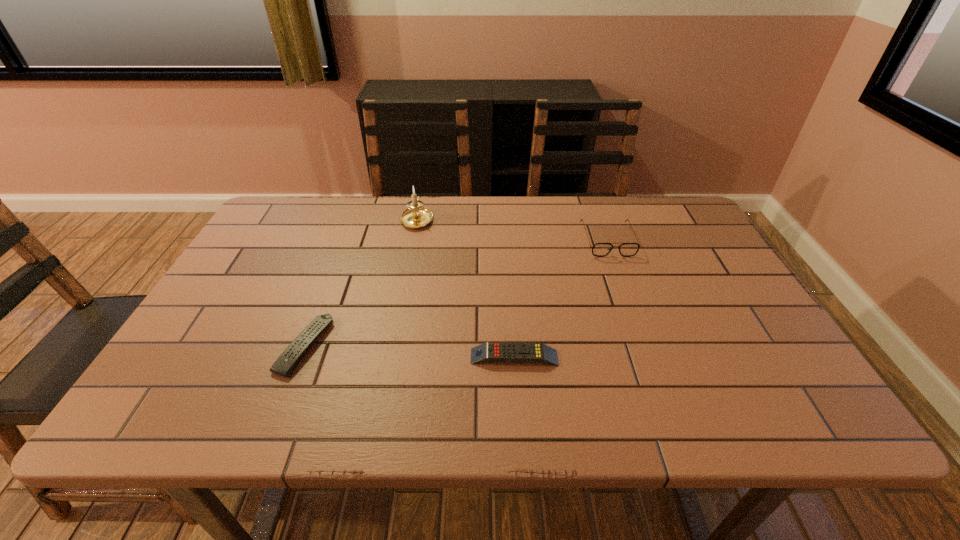
Locate an element on the screen. The width and height of the screenshot is (960, 540). free space between the tallest object and the right remote control is located at coordinates (466, 288).

I want to click on vacant area that lies between the leftmost object and the second object from left to right, so click(x=361, y=282).

What are the coordinates of `free spot between the right remote control and the left remote control` in the screenshot? It's located at (410, 352).

Find the location of a particular element. free space that is in between the right remote control and the left remote control is located at coordinates (410, 352).

I want to click on vacant region between the sunglasses and the tallest object, so point(513,230).

The image size is (960, 540). What are the coordinates of `unoccupied area between the rightmost object and the right remote control` in the screenshot? It's located at (561, 299).

Locate an element on the screen. This screenshot has width=960, height=540. free space between the leftmost object and the sunglasses is located at coordinates (456, 293).

The width and height of the screenshot is (960, 540). I want to click on free spot between the leftmost object and the sunglasses, so click(456, 293).

Locate which object is the second closest to the sunglasses. Please provide its 2D coordinates. Your answer should be formatted as a tuple, i.e. [(x, y)], where the tuple contains the x and y coordinates of a point satisfying the conditions above.

[(417, 216)]

Locate which object ranks in proximity to the third object from right to left. Please provide its 2D coordinates. Your answer should be formatted as a tuple, i.e. [(x, y)], where the tuple contains the x and y coordinates of a point satisfying the conditions above.

[(283, 366)]